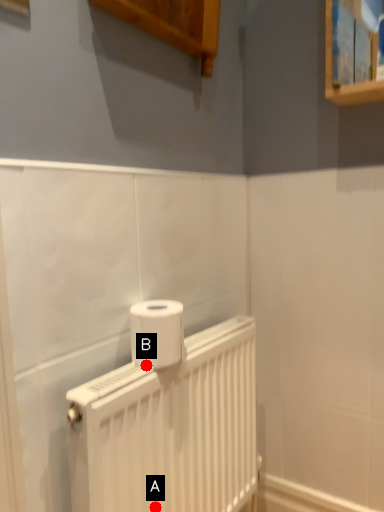
Question: Two points are circled on the image, labeled by A and B beside each circle. Which point is farther from the camera taking this photo?

Choices:
 (A) A is further
 (B) B is further

Answer: (A)